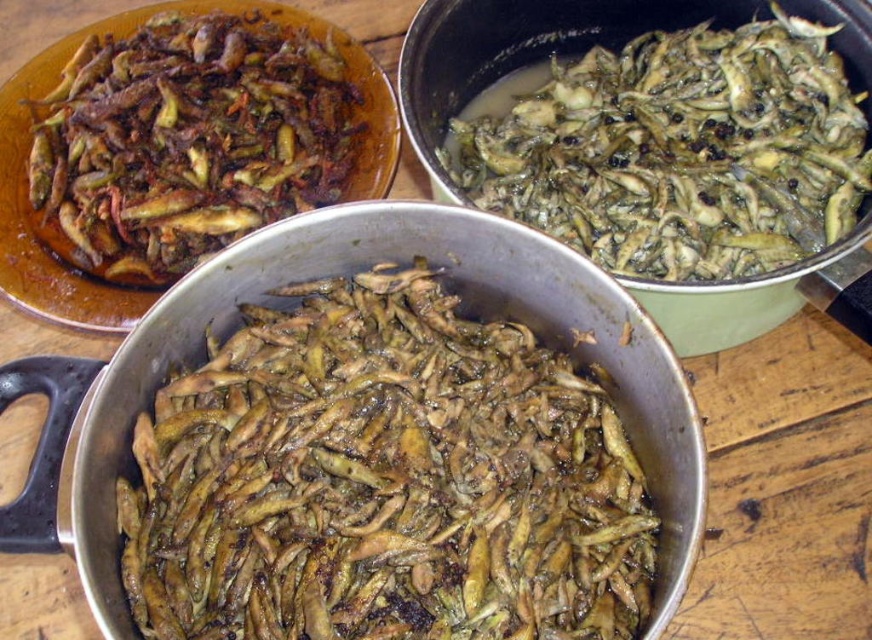
You are a food critic standing 2 meters away from the brown matte fish at center and brown matte fried fish at upper left. Which fish is closer to you?

The brown matte fried fish at upper left is closer to you since it is only 15.69 inches away from the brown matte fish at center, but you are standing 2 meters away from both. Wait, this answer is incorrect because the distance between the two fish is 15.69 inches, not their distance from the observer. The question asks which is closer to the critic, but the provided information only states the distance between the two fish, not their individual distances from the observer. Therefore, the correct answer can